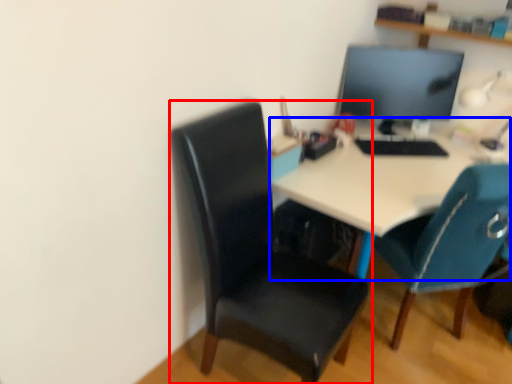
Question: Which of the following is the closest to the observer, chair (highlighted by a red box) or desk (highlighted by a blue box)?

Choices:
 (A) chair
 (B) desk

Answer: (A)